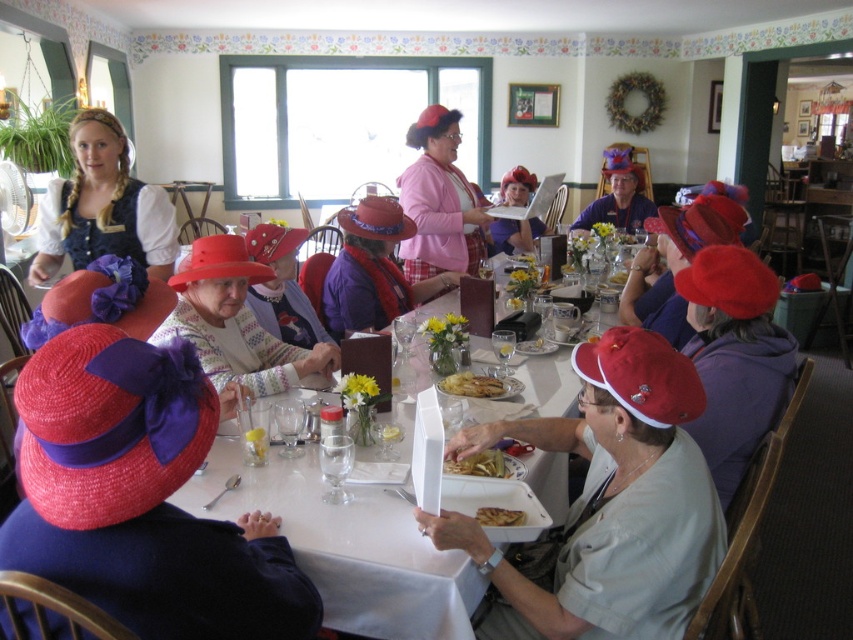
Question: Is white paper plate at center positioned in front of golden crispy fries at center?

Choices:
 (A) no
 (B) yes

Answer: (B)

Question: Among these objects, which one is farthest from the camera?

Choices:
 (A) matte pink hat at center
 (B) pink fabric hat at center
 (C) golden crispy fries at center

Answer: (A)

Question: Does matte black dirndl at left appear on the right side of yellowish fried food at lower center?

Choices:
 (A) no
 (B) yes

Answer: (A)

Question: In this image, where is golden crispy fries at center located relative to golden crispy pastry at lower center?

Choices:
 (A) right
 (B) left

Answer: (B)

Question: Which is nearer to the matte pink hat at center?

Choices:
 (A) golden crispy fries at center
 (B) yellowish fried food at lower center
 (C) pink fabric hat at center

Answer: (C)

Question: Which of these objects is positioned farthest from the golden crispy pastry at lower center?

Choices:
 (A) matte straw hat at center
 (B) pink fabric hat at center
 (C) white paper plate at center

Answer: (B)